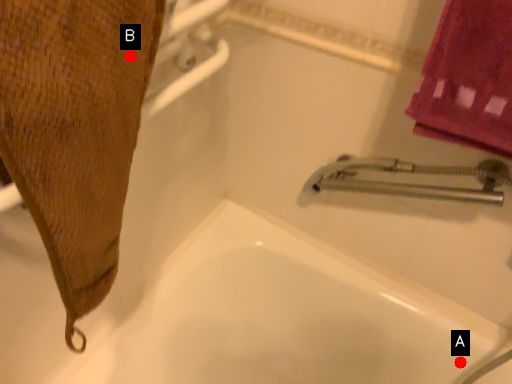
Question: Two points are circled on the image, labeled by A and B beside each circle. Which point is closer to the camera?

Choices:
 (A) A is closer
 (B) B is closer

Answer: (B)